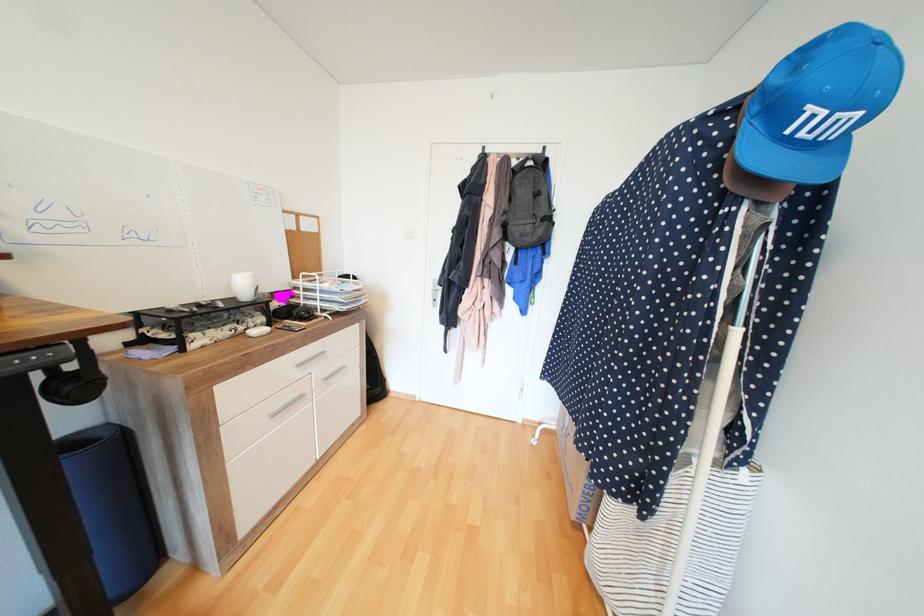
Where would you lift the white file sorter? Please return your answer as a coordinate pair (x, y).

(329, 291)